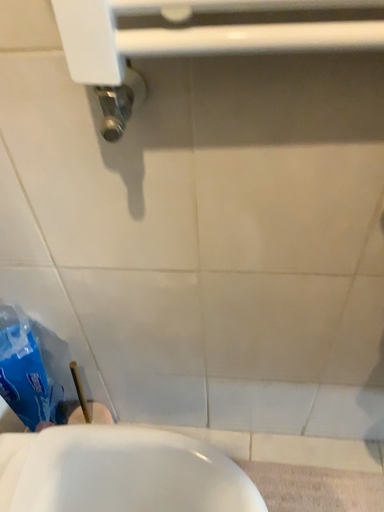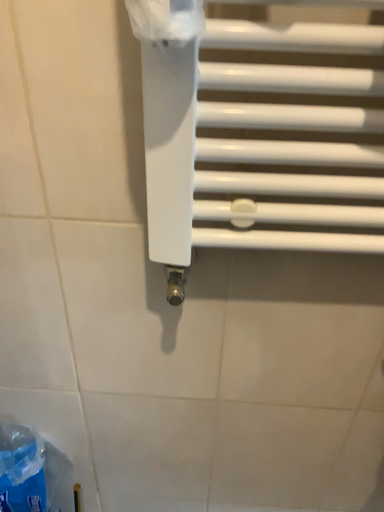
Question: How did the camera likely rotate when shooting the video?

Choices:
 (A) rotated downward
 (B) rotated upward

Answer: (B)